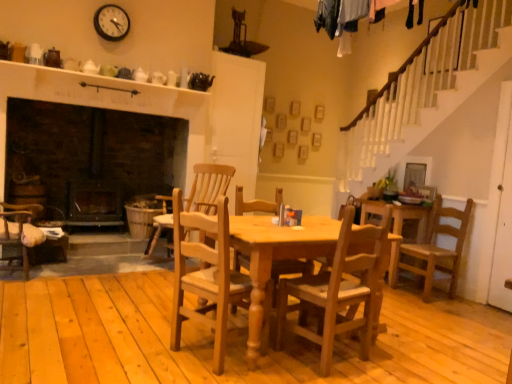
Question: Would you say light brown wood chair at center, acting as the fourth chair starting from the front, contains light brown wooden chair at right, the 3th chair viewed from the front?

Choices:
 (A) no
 (B) yes

Answer: (A)

Question: Does light brown wood chair at center, arranged as the 1th chair when viewed from the back, have a greater height compared to light brown wooden chair at right, the second chair from the back?

Choices:
 (A) yes
 (B) no

Answer: (A)

Question: Can you confirm if light brown wood chair at center, acting as the fourth chair starting from the front, is positioned to the left of light brown wooden chair at right, acting as the 1th chair starting from the right?

Choices:
 (A) yes
 (B) no

Answer: (A)

Question: Does light brown wood chair at center, the first chair when ordered from left to right, come in front of light brown wooden chair at right, placed as the 4th chair when sorted from left to right?

Choices:
 (A) no
 (B) yes

Answer: (A)

Question: Is light brown wood chair at center, which appears as the fourth chair when viewed from the right, completely or partially outside of light brown wooden chair at right, the second chair from the back?

Choices:
 (A) no
 (B) yes

Answer: (B)

Question: Choose the correct answer: Is black plastic clock at upper center inside light brown wood chair at center, arranged as the 1th chair when viewed from the back, or outside it?

Choices:
 (A) outside
 (B) inside

Answer: (A)

Question: From their relative heights in the image, would you say black plastic clock at upper center is taller or shorter than light brown wood chair at center, acting as the fourth chair starting from the front?

Choices:
 (A) short
 (B) tall

Answer: (A)

Question: Is black plastic clock at upper center wider or thinner than light brown wood chair at center, acting as the fourth chair starting from the front?

Choices:
 (A) wide
 (B) thin

Answer: (B)

Question: In the image, is black plastic clock at upper center positioned in front of or behind light brown wood chair at center, which appears as the fourth chair when viewed from the right?

Choices:
 (A) behind
 (B) front

Answer: (A)

Question: From the image's perspective, relative to black plastic clock at upper center, is light brown wooden chair at right, acting as the 1th chair starting from the right, above or below?

Choices:
 (A) above
 (B) below

Answer: (B)

Question: Which is correct: light brown wooden chair at right, placed as the 4th chair when sorted from left to right, is inside black plastic clock at upper center, or outside of it?

Choices:
 (A) outside
 (B) inside

Answer: (A)

Question: Based on their positions, is light brown wooden chair at right, acting as the 1th chair starting from the right, located to the left or right of black plastic clock at upper center?

Choices:
 (A) left
 (B) right

Answer: (B)

Question: From a real-world perspective, is light brown wooden chair at right, the 3th chair viewed from the front, positioned above or below black plastic clock at upper center?

Choices:
 (A) above
 (B) below

Answer: (B)

Question: Is black plastic clock at upper center in front of or behind light brown wooden chair at right, placed as the 4th chair when sorted from left to right, in the image?

Choices:
 (A) behind
 (B) front

Answer: (A)

Question: In terms of size, does black plastic clock at upper center appear bigger or smaller than light brown wooden chair at right, acting as the 1th chair starting from the right?

Choices:
 (A) big
 (B) small

Answer: (B)